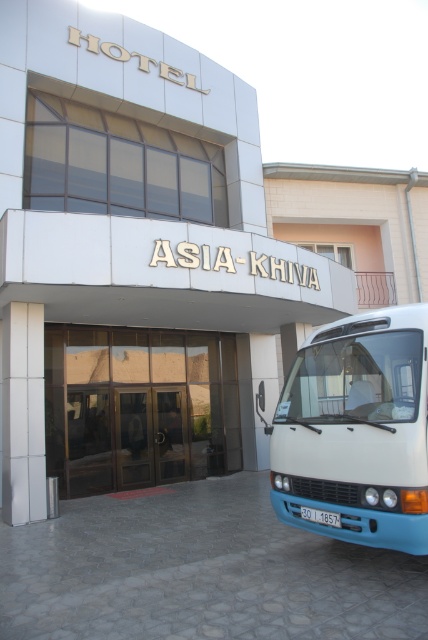
You are a delivery driver approaching the hotel entrance. You see the white glossy van at right and the shiny glass doors at center. Which vehicle is closer to you?

The white glossy van at right is closer to the viewer than the shiny glass doors at center.

You are standing in front of the Asia Khiva Hotel. There is a point marked at coordinates (347,355) on the hotel facade. If you want to touch this point with a 5 meter long pole, will you be able to reach it?

The point at coordinates (347,355) is 5.11 meters away from the viewer. Since the pole is only 5 meters long, it is 0.11 meters too short to reach the point. Therefore, you cannot touch the point with the pole.

You are a photographer wanting to capture the entrance of the hotel. You notice the white glossy van at right and the shiny glass doors at center. Which object should you focus on if you want to highlight something taller in your photo?

The shiny glass doors at center are taller than the white glossy van at right, so focusing on the shiny glass doors at center would highlight the taller object in your photo.